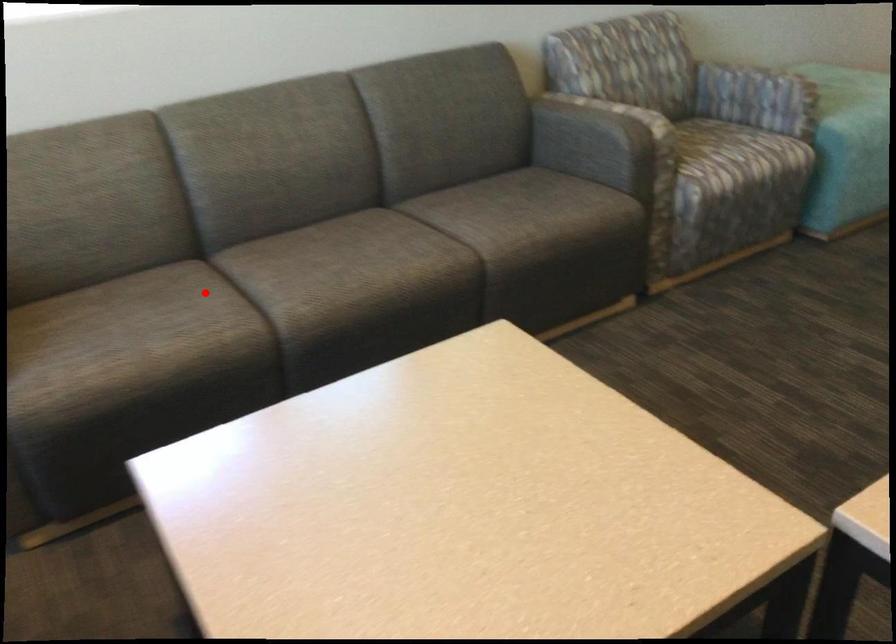
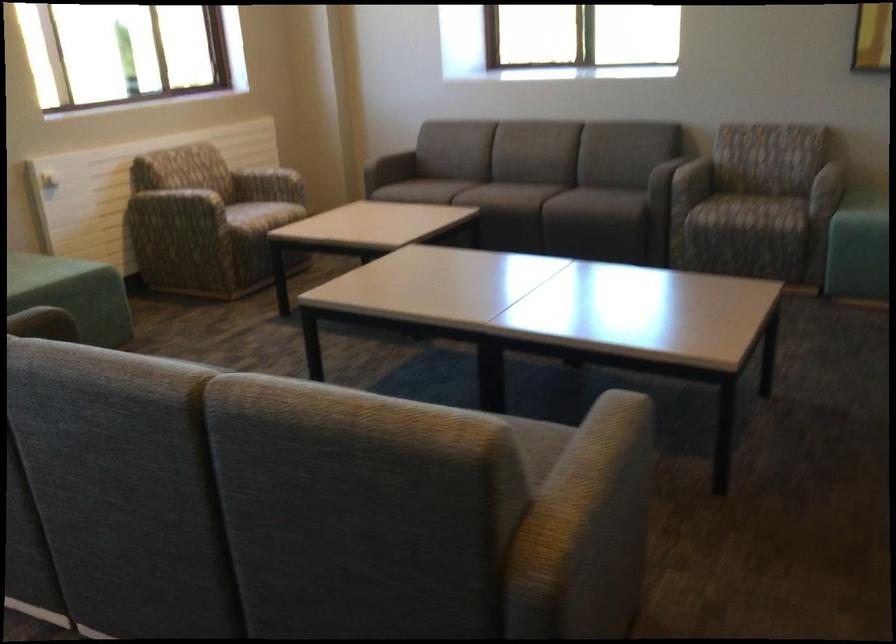
Question: I am providing you with two images of the same scene from different viewpoints. Image1 has a red point marked. In image2, the corresponding 3D location appears at what relative position? Reply with the corresponding letter.

Choices:
 (A) Closer
 (B) Farther

Answer: (B)